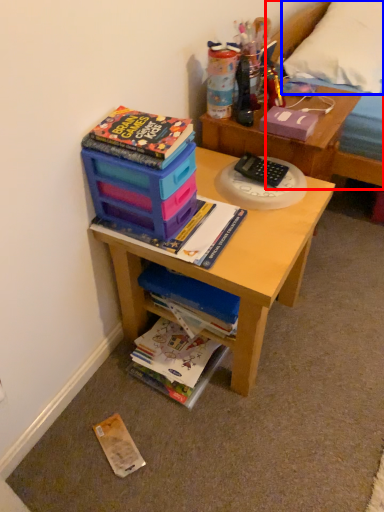
Question: Among these objects, which one is nearest to the camera, bed frame (highlighted by a red box) or pillow (highlighted by a blue box)?

Choices:
 (A) bed frame
 (B) pillow

Answer: (A)